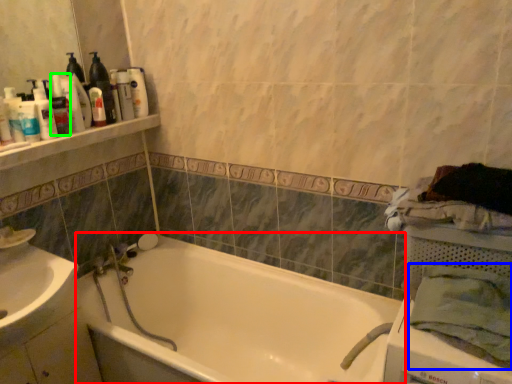
Question: Estimate the real-world distances between objects in this image. Which object is closer to bathtub (highlighted by a red box), bath towel (highlighted by a blue box) or toiletry (highlighted by a green box)?

Choices:
 (A) bath towel
 (B) toiletry

Answer: (A)